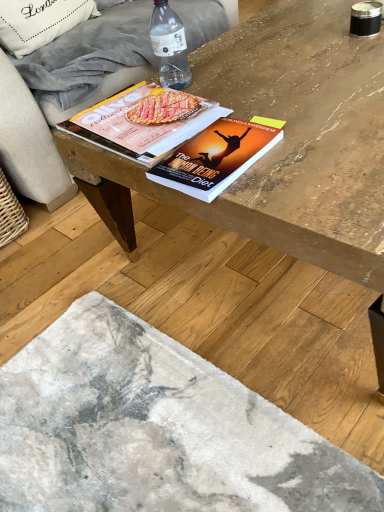
At what (x,y) coordinates should I click in order to perform the action: click on free location in front of transparent plastic bottle at upper center. Please return your answer as a coordinate pair (x, y). Looking at the image, I should click on (224, 100).